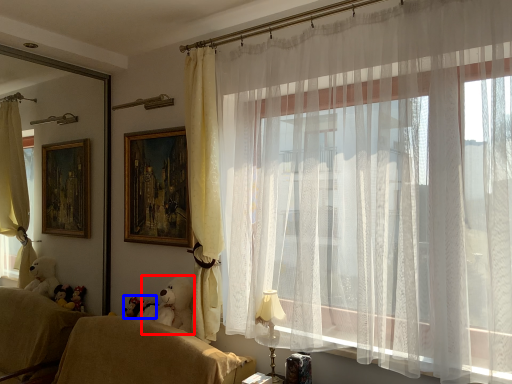
Question: Among these objects, which one is nearest to the camera, animal (highlighted by a red box) or toy (highlighted by a blue box)?

Choices:
 (A) animal
 (B) toy

Answer: (A)